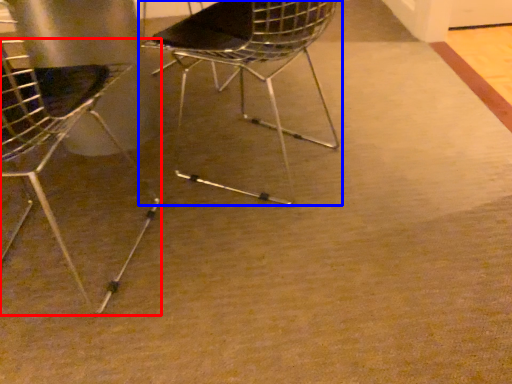
Question: Which point is further to the camera, chair (highlighted by a red box) or chair (highlighted by a blue box)?

Choices:
 (A) chair
 (B) chair

Answer: (B)